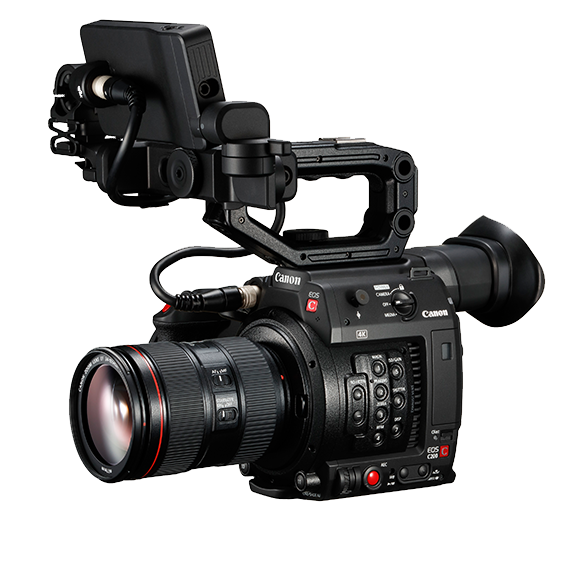
Identify the location of handle. Image resolution: width=580 pixels, height=580 pixels. (336, 158).